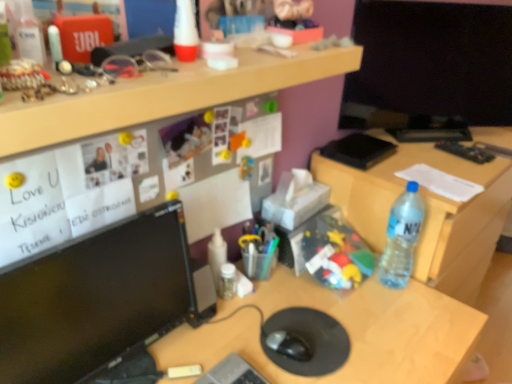
Question: Does black matte mouse at center contain gray plastic laptop keyboard at center?

Choices:
 (A) no
 (B) yes

Answer: (A)

Question: Is black matte mouse at center further to camera compared to gray plastic laptop keyboard at center?

Choices:
 (A) yes
 (B) no

Answer: (A)

Question: Can you confirm if black matte mouse at center is smaller than gray plastic laptop keyboard at center?

Choices:
 (A) no
 (B) yes

Answer: (B)

Question: Is black matte mouse at center to the left of gray plastic laptop keyboard at center from the viewer's perspective?

Choices:
 (A) no
 (B) yes

Answer: (A)

Question: From a real-world perspective, is black matte mouse at center physically above gray plastic laptop keyboard at center?

Choices:
 (A) yes
 (B) no

Answer: (B)

Question: From the image's perspective, is black matte mouse at center below gray plastic laptop keyboard at center?

Choices:
 (A) yes
 (B) no

Answer: (B)

Question: Does black matte notepad at upper right have a lesser width compared to gray plastic laptop keyboard at center?

Choices:
 (A) yes
 (B) no

Answer: (B)

Question: Is black matte notepad at upper right not inside gray plastic laptop keyboard at center?

Choices:
 (A) yes
 (B) no

Answer: (A)

Question: Considering the relative sizes of black matte notepad at upper right and gray plastic laptop keyboard at center in the image provided, is black matte notepad at upper right bigger than gray plastic laptop keyboard at center?

Choices:
 (A) no
 (B) yes

Answer: (A)

Question: From the image's perspective, is black matte notepad at upper right over gray plastic laptop keyboard at center?

Choices:
 (A) yes
 (B) no

Answer: (A)

Question: Considering the relative positions of black matte notepad at upper right and gray plastic laptop keyboard at center in the image provided, is black matte notepad at upper right behind gray plastic laptop keyboard at center?

Choices:
 (A) no
 (B) yes

Answer: (B)

Question: Is black matte notepad at upper right positioned with its back to gray plastic laptop keyboard at center?

Choices:
 (A) yes
 (B) no

Answer: (B)

Question: Does translucent plastic bottle at right, which appears as the 1th bottle when viewed from the right, have a greater width compared to black glossy monitor at left?

Choices:
 (A) yes
 (B) no

Answer: (B)